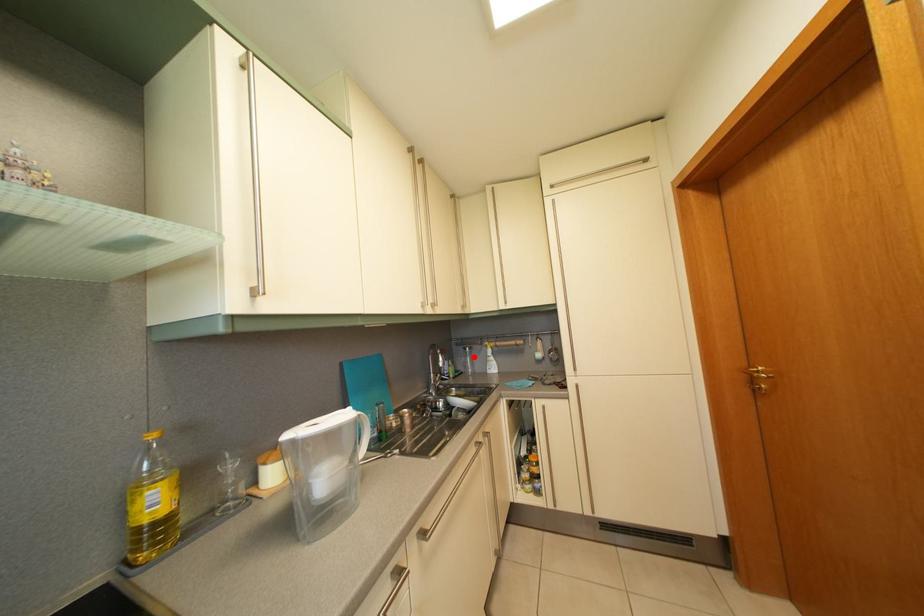
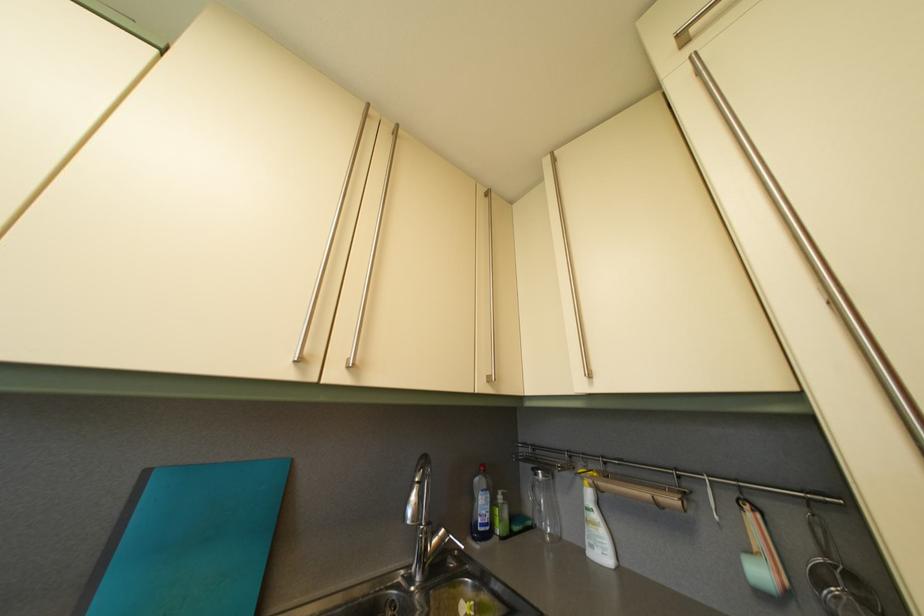
The point at the highlighted location is marked in the first image. Where is the corresponding point in the second image?

(544, 482)